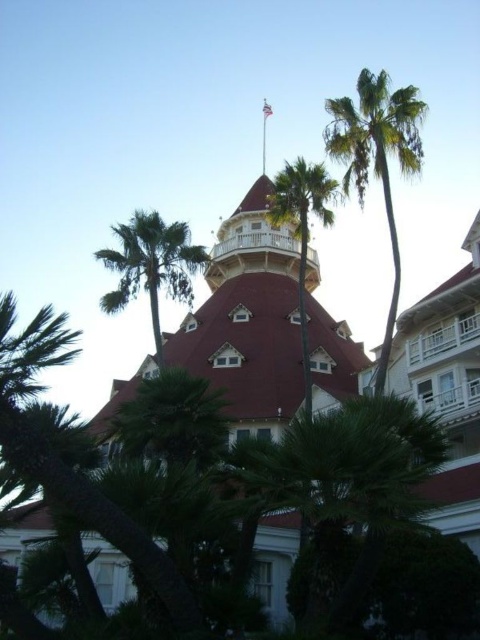
Can you confirm if green leafy palm tree at right is positioned to the right of green leafy palm tree at upper center?

Correct, you'll find green leafy palm tree at right to the right of green leafy palm tree at upper center.

Locate an element on the screen. The image size is (480, 640). green leafy palm tree at right is located at coordinates (376, 160).

Find the location of a particular element. This screenshot has width=480, height=640. green leafy palm tree at right is located at coordinates click(376, 160).

Is green leafy palm tree at right smaller than green leafy palm tree at center?

Incorrect, green leafy palm tree at right is not smaller in size than green leafy palm tree at center.

Between green leafy palm tree at right and green leafy palm tree at center, which one is positioned lower?

green leafy palm tree at center is lower down.

Between point (364, 147) and point (302, 307), which one is positioned behind?

Positioned behind is point (302, 307).

Image resolution: width=480 pixels, height=640 pixels. In order to click on green leafy palm tree at right in this screenshot , I will do `click(376, 160)`.

Consider the image. Who is higher up, white wood hotel at center or green leafy palm tree at upper center?

green leafy palm tree at upper center is above.

From the picture: Who is lower down, white wood hotel at center or green leafy palm tree at upper center?

Positioned lower is white wood hotel at center.

Who is more forward, (224, 364) or (148, 268)?

Positioned in front is point (148, 268).

You are a GUI agent. You are given a task and a screenshot of the screen. Output one action in this format:
    pyautogui.click(x=<x>, y=<y>)
    Task: Click on the white wood hotel at center
    Image resolution: width=480 pixels, height=640 pixels.
    Given the screenshot: What is the action you would take?
    pyautogui.click(x=251, y=243)